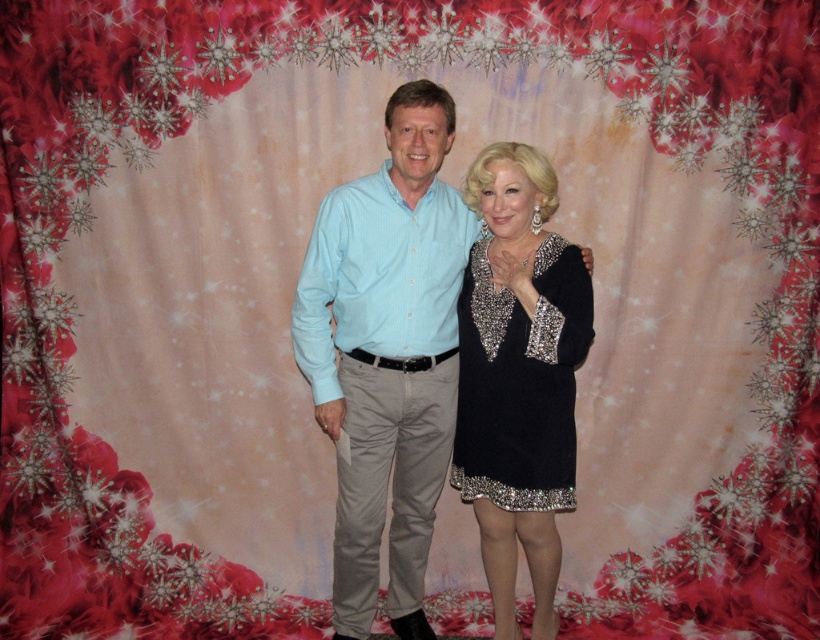
Question: Does light blue shirt at center appear on the left side of black sequined dress at center?

Choices:
 (A) no
 (B) yes

Answer: (B)

Question: Which of the following is the closest to the observer?

Choices:
 (A) light blue shirt at center
 (B) black sequined dress at center

Answer: (A)

Question: Which point appears closest to the camera in this image?

Choices:
 (A) (349, 272)
 (B) (540, 340)

Answer: (B)

Question: Observing the image, what is the correct spatial positioning of light blue shirt at center in reference to black sequined dress at center?

Choices:
 (A) right
 (B) left

Answer: (B)

Question: Can you confirm if light blue shirt at center is thinner than black sequined dress at center?

Choices:
 (A) no
 (B) yes

Answer: (A)